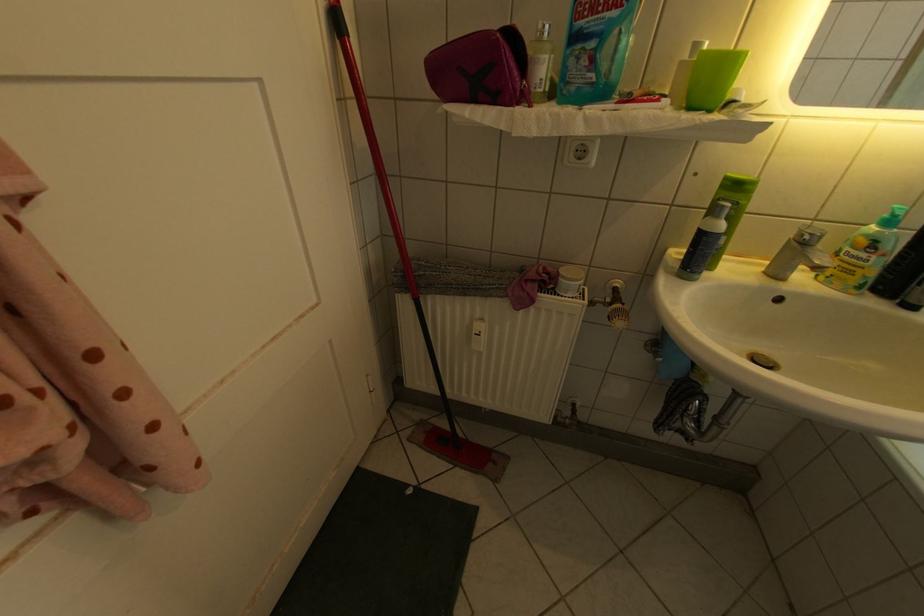
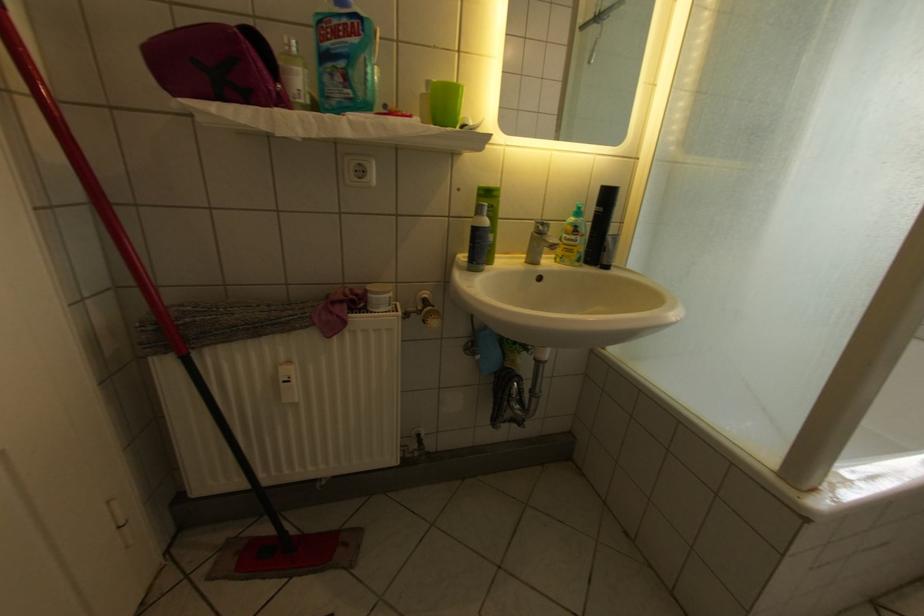
In the second image, find the point that corresponds to the point at 738,180 in the first image.

(492, 191)